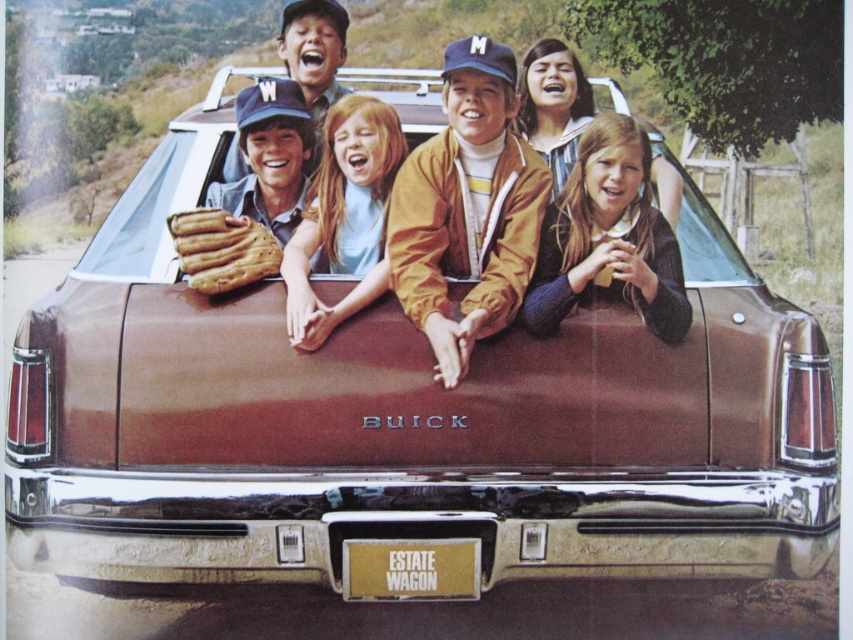
In the scene shown: You are standing in front of the vintage Buick Estate Wagon. There is a point at coordinates point (314, 49). What object is this point located on?

The point (314, 49) is located on the matte brown baseball glove at center.

You are a photographer trying to capture a clear shot of both the matte brown baseball glove at center and the brown leather baseball glove at center. Since they are stacked, which one should you focus on to ensure the bottom one is visible?

The matte brown baseball glove at center is positioned over the brown leather baseball glove at center, so you should focus on the brown leather baseball glove at center to ensure the bottom one is visible.